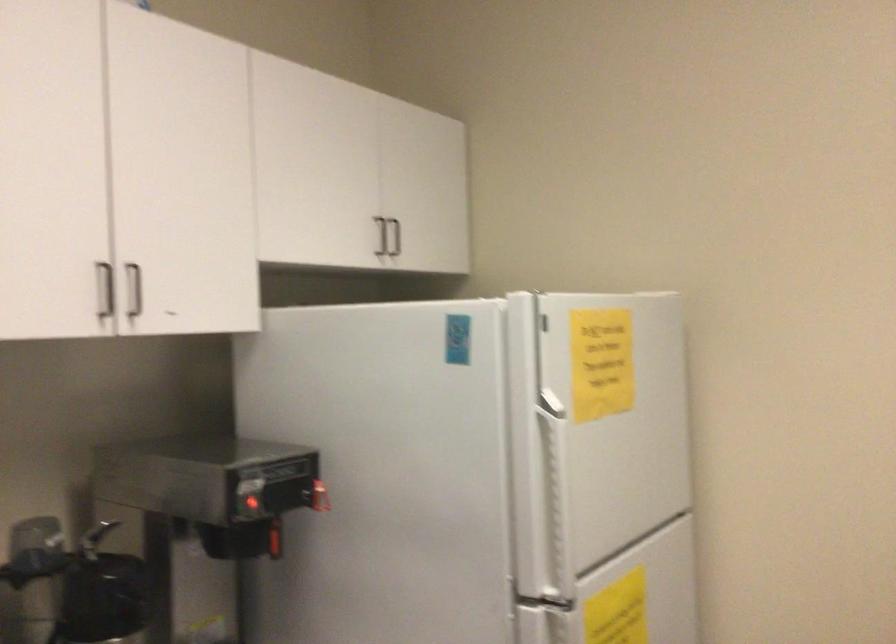
Question: The camera is either moving clockwise (left) or counter-clockwise (right) around the object. The first image is from the beginning of the video and the second image is from the end. Is the camera moving left or right when shooting the video?

Choices:
 (A) Left
 (B) Right

Answer: (B)